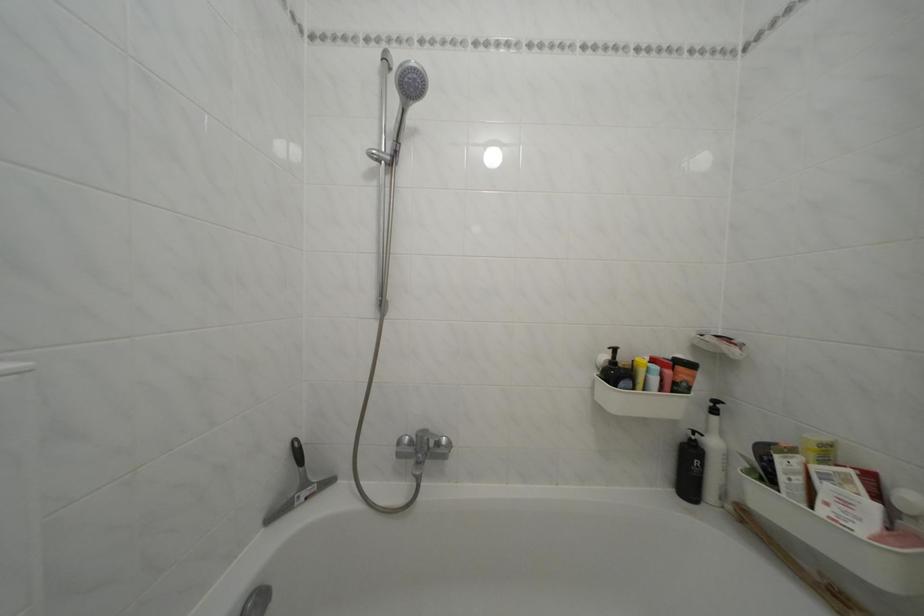
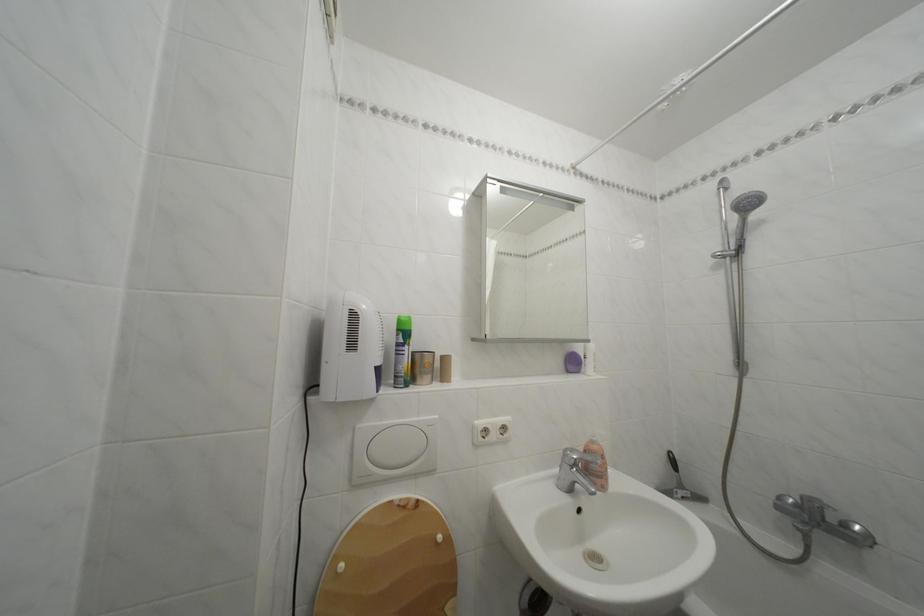
Where in the second image is the point corresponding to [314,491] from the first image?

(689, 492)